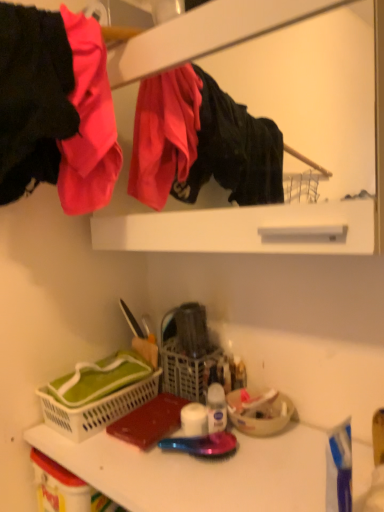
Locate an element on the screen. The image size is (384, 512). vacant space in front of transparent plastic spray bottle at center is located at coordinates (225, 478).